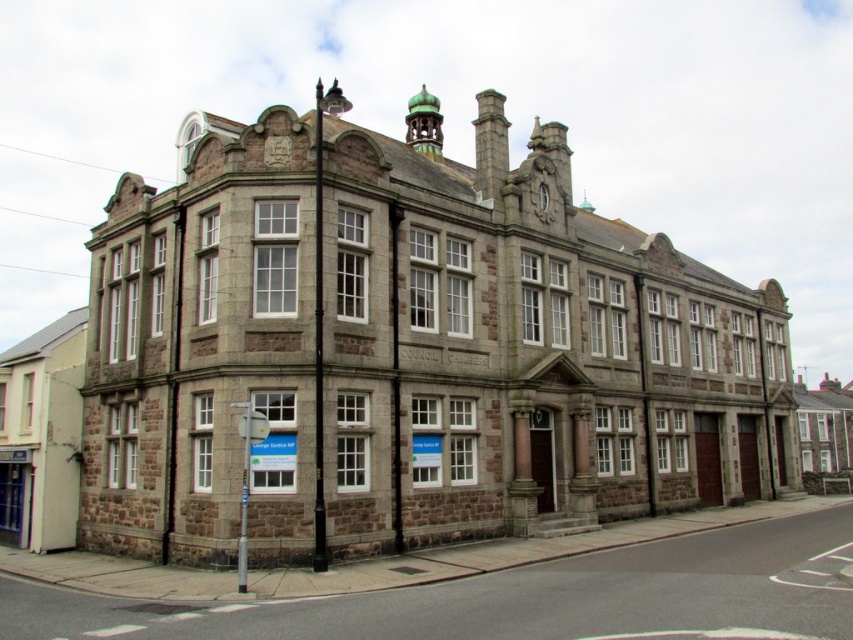
Can you confirm if metallic silver sign at lower left is shorter than dark gray stone clock at upper center?

In fact, metallic silver sign at lower left may be taller than dark gray stone clock at upper center.

Between metallic silver sign at lower left and dark gray stone clock at upper center, which one appears on the left side from the viewer's perspective?

metallic silver sign at lower left is more to the left.

Is point (238, 588) behind point (289, 140)?

No, (238, 588) is in front of (289, 140).

Find the location of a particular element. metallic silver sign at lower left is located at coordinates (247, 477).